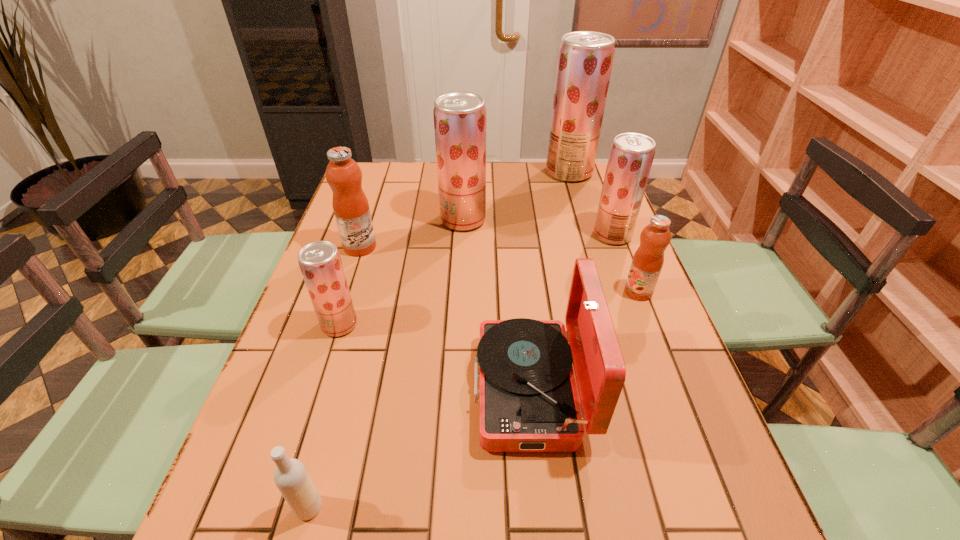
Where is `the tallest fruit juice`? The width and height of the screenshot is (960, 540). the tallest fruit juice is located at coordinates (585, 59).

You are a GUI agent. You are given a task and a screenshot of the screen. Output one action in this format:
    pyautogui.click(x=<x>, y=<y>)
    Task: Click on the biggest strawberry fruit juice
    The image size is (960, 540).
    Given the screenshot: What is the action you would take?
    pyautogui.click(x=585, y=59)

This screenshot has height=540, width=960. I want to click on the fifth shortest fruit juice, so click(459, 117).

You are a GUI agent. You are given a task and a screenshot of the screen. Output one action in this format:
    pyautogui.click(x=<x>, y=<y>)
    Task: Click on the second tallest object
    
    Given the screenshot: What is the action you would take?
    (x=459, y=117)

In order to click on the third biggest strawberry fruit juice in this screenshot , I will do `click(631, 155)`.

Where is `the bigger orange fruit juice`? the bigger orange fruit juice is located at coordinates (350, 205).

Locate an element on the screen. The image size is (960, 540). the left orange fruit juice is located at coordinates (350, 205).

At what (x,y) coordinates should I click in order to perform the action: click on phonograph_record. Please return your answer as a coordinate pair (x, y). Looking at the image, I should click on (528, 399).

The height and width of the screenshot is (540, 960). What are the coordinates of `the smallest strawberry fruit juice` in the screenshot? It's located at (320, 262).

Where is `the leftmost strawberry fruit juice`? The height and width of the screenshot is (540, 960). the leftmost strawberry fruit juice is located at coordinates (320, 262).